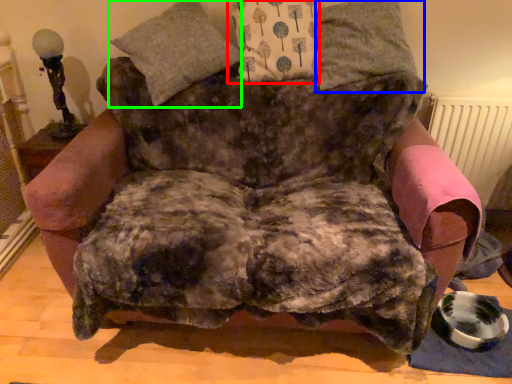
Question: Based on their relative distances, which object is farther from pillow (highlighted by a red box)? Choose from pillow (highlighted by a blue box) and pillow (highlighted by a green box).

Choices:
 (A) pillow
 (B) pillow

Answer: (B)